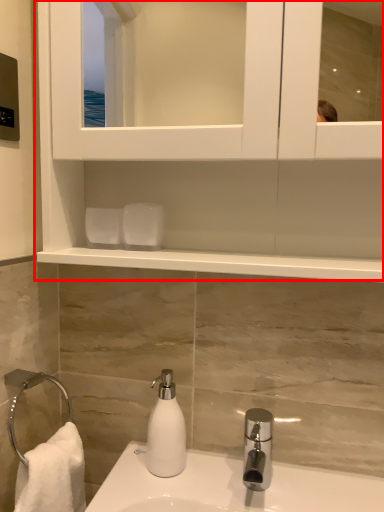
Question: From the image's perspective, where is cabinet (annotated by the red box) located in relation to soap dispenser in the image?

Choices:
 (A) above
 (B) below

Answer: (A)